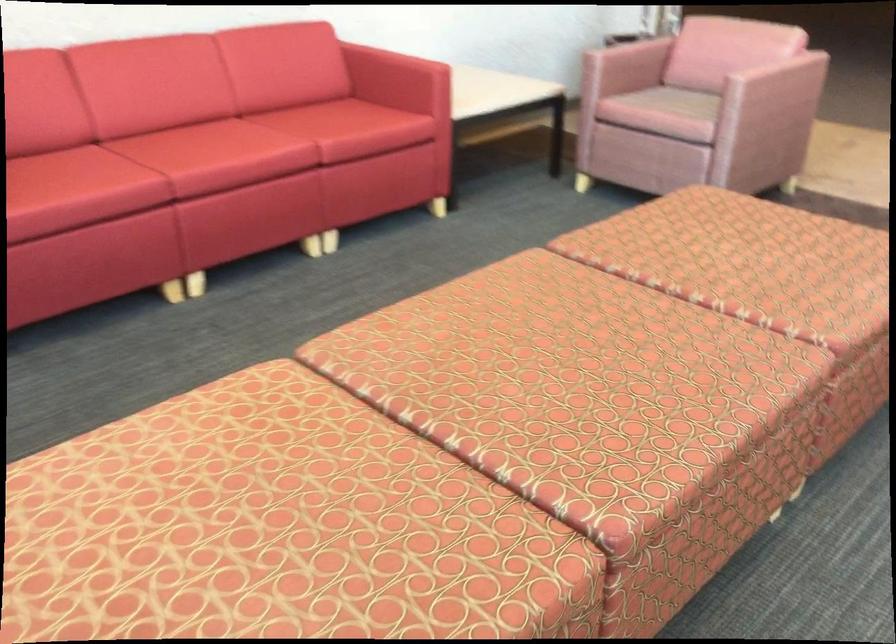
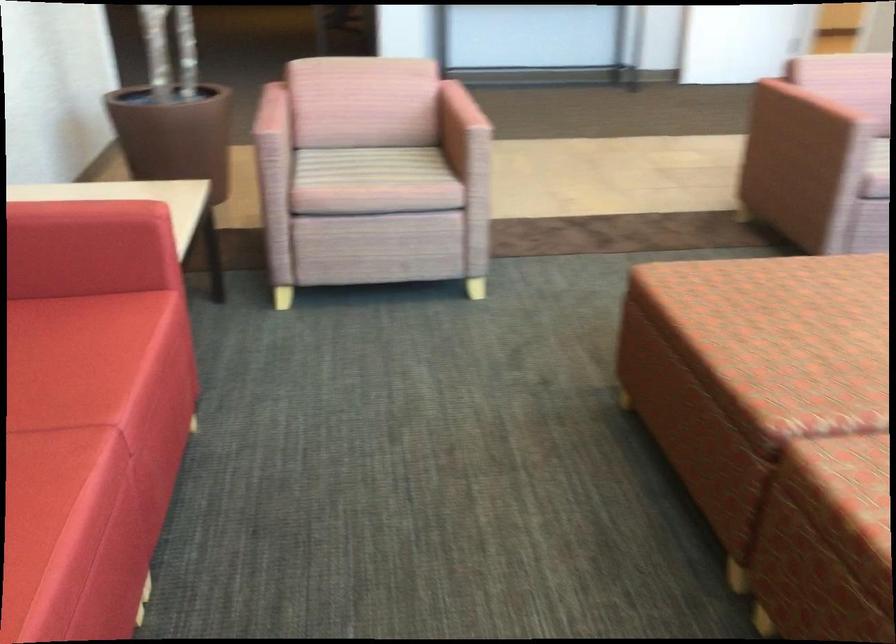
Question: I am providing you with two images of the same scene from different viewpoints. After the viewpoint changes to image2, which objects are now occluded?

Choices:
 (A) blue network port
 (B) patterned sofa sitting surface
 (C) red sofa sitting surface
 (D) chair armrest

Answer: (D)